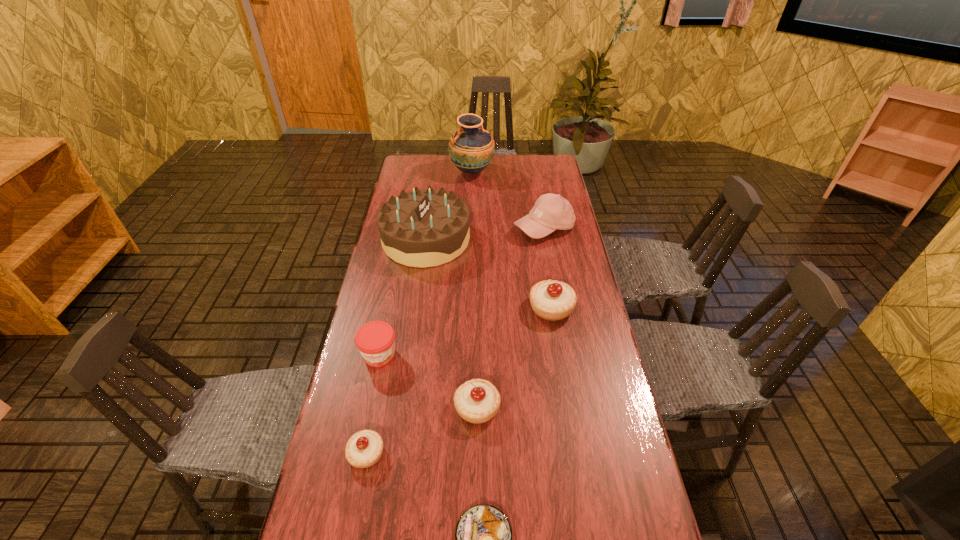
This screenshot has height=540, width=960. In order to click on the second farthest beige pastry in this screenshot , I will do `click(477, 401)`.

This screenshot has height=540, width=960. Identify the location of the second tallest pastry. (477, 401).

Locate an element on the screen. This screenshot has height=540, width=960. the leftmost pastry is located at coordinates (364, 448).

Where is `the seventh farthest object`? Image resolution: width=960 pixels, height=540 pixels. the seventh farthest object is located at coordinates (364, 448).

Image resolution: width=960 pixels, height=540 pixels. I want to click on free spot located on the right of the pottery, so pos(526,172).

Image resolution: width=960 pixels, height=540 pixels. Find the location of `free space located on the front-facing side of the seventh shortest object`. free space located on the front-facing side of the seventh shortest object is located at coordinates (534, 240).

Where is `vacant space located on the front-facing side of the pink baseball cap`? The height and width of the screenshot is (540, 960). vacant space located on the front-facing side of the pink baseball cap is located at coordinates (561, 317).

You are a GUI agent. You are given a task and a screenshot of the screen. Output one action in this format:
    pyautogui.click(x=<x>, y=<y>)
    Task: Click on the vacant point located on the front of the farthest pastry
    The height and width of the screenshot is (540, 960).
    Given the screenshot: What is the action you would take?
    pyautogui.click(x=564, y=390)

Find the location of `free space located 0.050m on the label side of the jam`. free space located 0.050m on the label side of the jam is located at coordinates coord(372,386).

At what (x,y) coordinates should I click in order to perform the action: click on vacant area situated on the right of the second beige pastry from right to left. Please return your answer as a coordinate pair (x, y). The image size is (960, 540). Looking at the image, I should click on (595, 407).